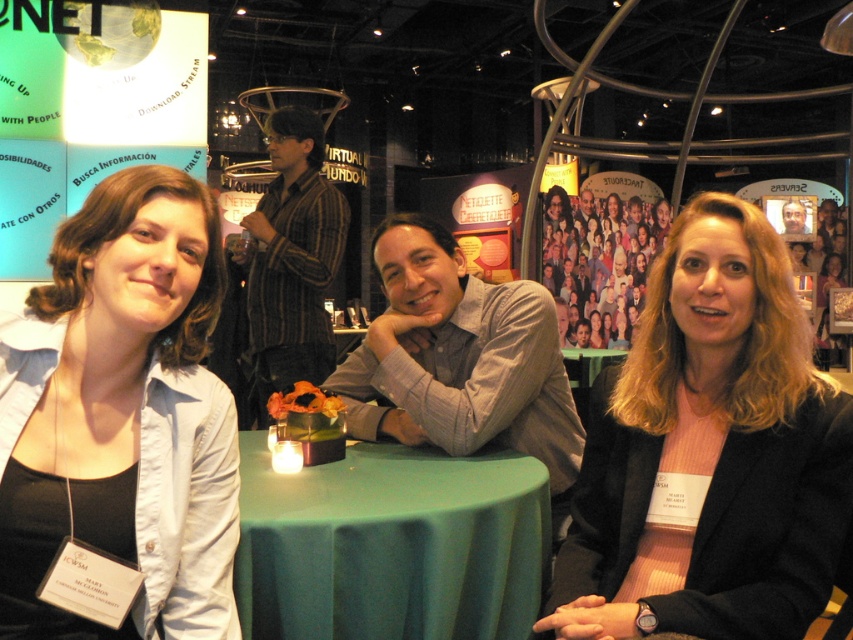
You are standing at the entrance of the booth and want to approach both the matte blue shirt at center and the brown leather jacket at center. Which one should you walk towards first if you want to minimize the distance you have to walk?

Since the matte blue shirt at center and brown leather jacket at center are only 17.49 feet apart from each other, you can choose either one first as the distance between them is the same.

You are at the conference and want to approach the person wearing the matte blue shirt at center. Based on their position, which direction should you move from your current location to reach them?

The matte blue shirt at center is located at point coordinates, so you should move towards the center of the booth to reach them.

You are a photographer at the event and want to take a closeup of the gray cotton shirt at center and the matte black shirt at center. Which one will appear larger in the photo?

The gray cotton shirt at center will appear larger in the photo because it is closer to the viewer than the matte black shirt at center.